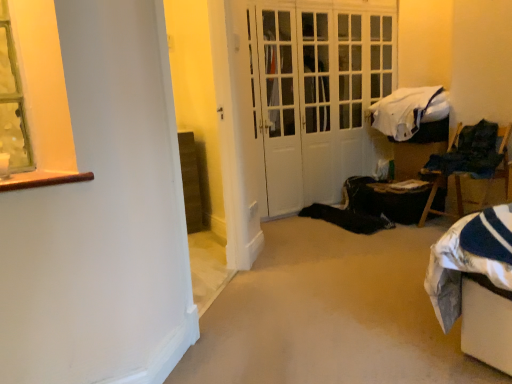
Question: From the image's perspective, relative to white glossy door at center, is black fabric bag at lower right above or below?

Choices:
 (A) below
 (B) above

Answer: (A)

Question: Is black fabric bag at lower right spatially inside white glossy door at center, or outside of it?

Choices:
 (A) inside
 (B) outside

Answer: (B)

Question: Estimate the real-world distances between objects in this image. Which object is closer to the black fabric bag at lower right?

Choices:
 (A) wooden chair at right
 (B) white soft blanket at upper right
 (C) white glossy door at center

Answer: (A)

Question: Which of these objects is positioned farthest from the white glossy door at center?

Choices:
 (A) black fabric bag at lower right
 (B) white soft blanket at upper right
 (C) wooden chair at right

Answer: (C)